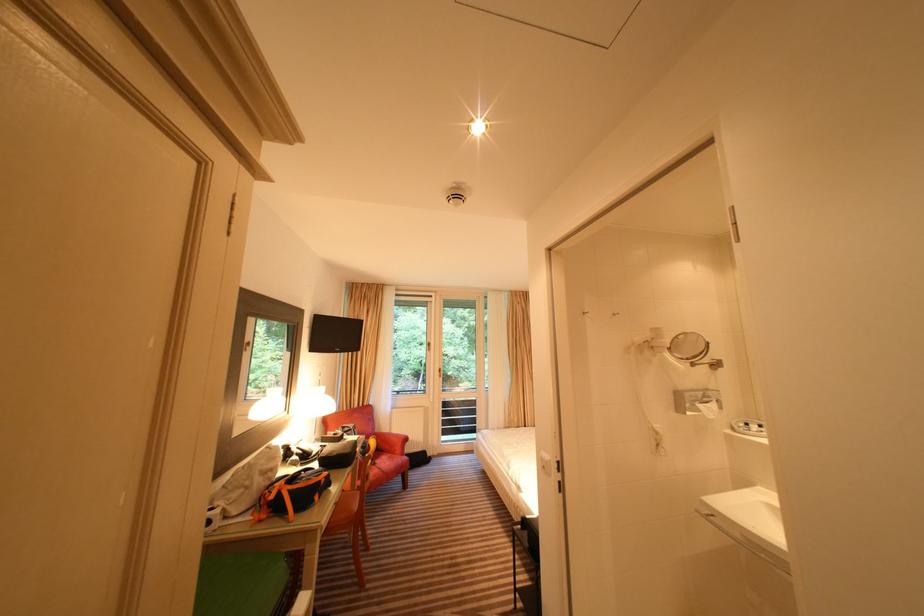
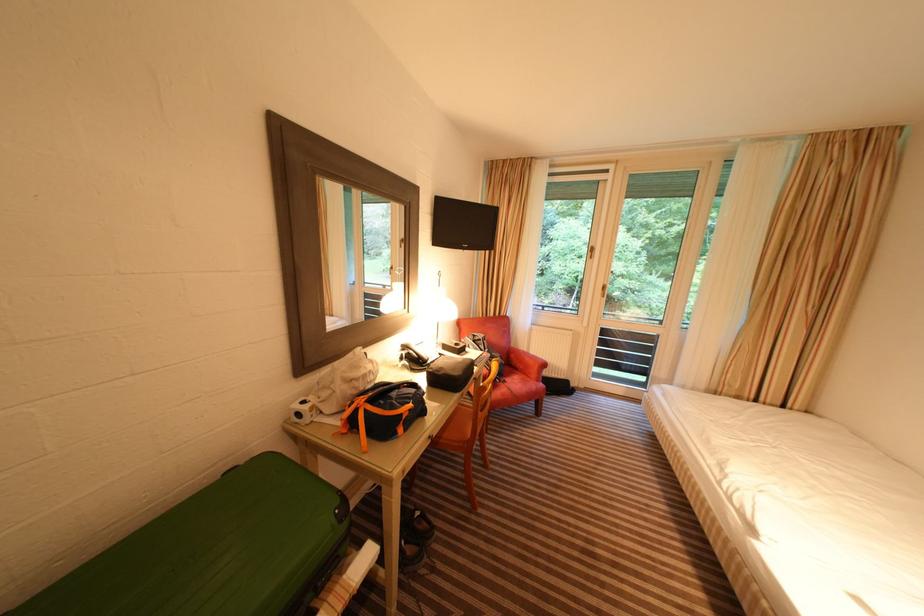
Where in the second image is the point corresponding to (x=355, y=472) from the first image?

(463, 399)